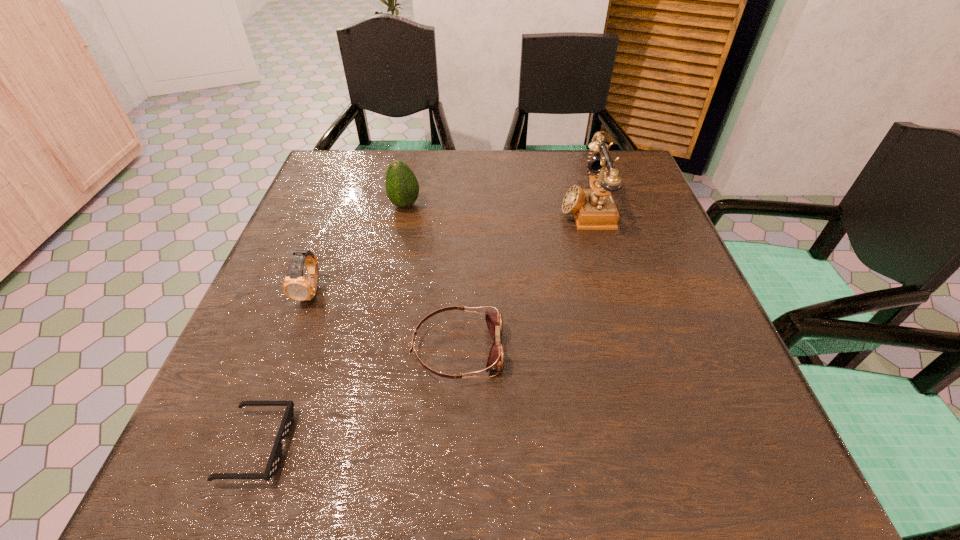
I want to click on empty space that is in between the tallest object and the shortest object, so click(421, 327).

I want to click on object identified as the second closest to the second tallest object, so click(495, 361).

Where is `the fourth closest object relative to the second tallest object`? the fourth closest object relative to the second tallest object is located at coordinates (275, 458).